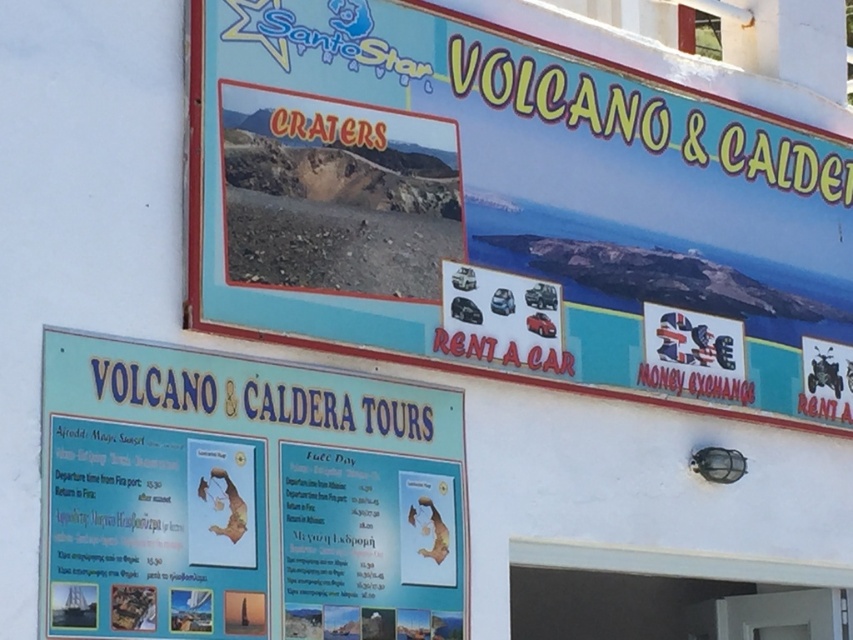
What is the spatial relationship between the blue plastic signboard at upper center and the blue paperboard sign at lower center?

The blue plastic signboard at upper center is to the right of the blue paperboard sign at lower center.

You are standing at the entrance of the building and want to read both the blue plastic signboard at upper center and the teal background section below it. If you can only move your head 10 degrees upward or downward, can you read both without moving your feet?

The blue plastic signboard at upper center and the teal background section below it are 9.96 meters apart. Since you can move your head 10 degrees, which is slightly more than the required angle, you can read both without moving your feet.